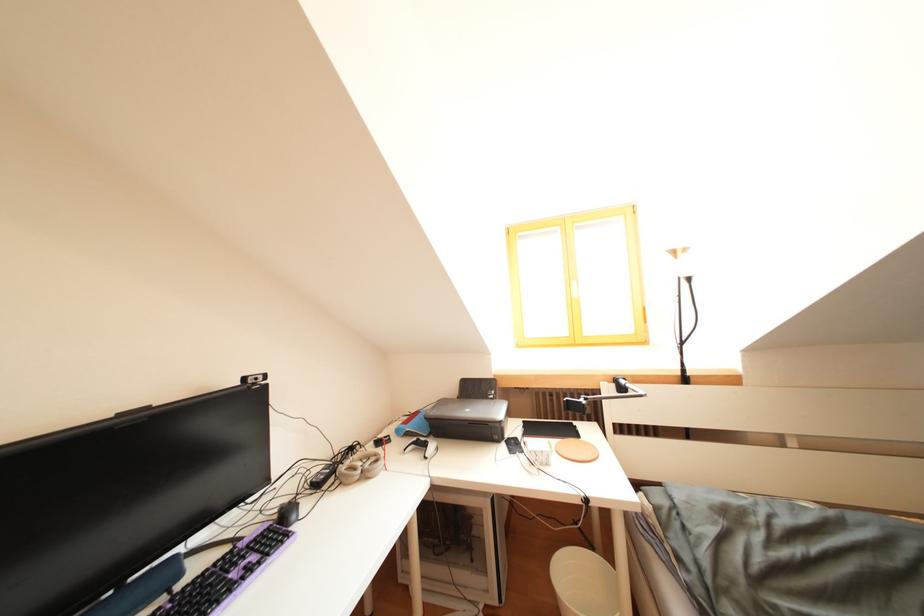
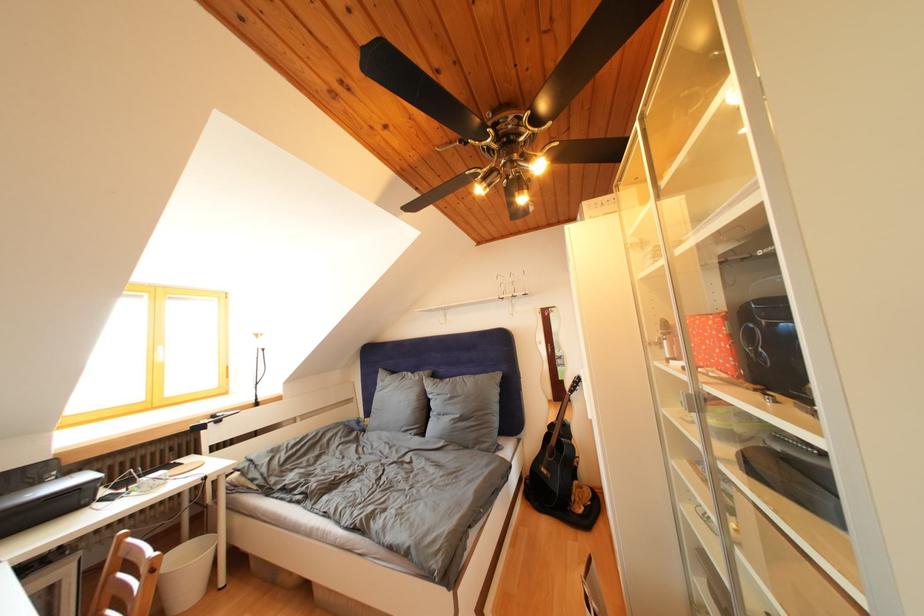
The point at (492,400) is marked in the first image. Where is the corresponding point in the second image?

(44, 488)